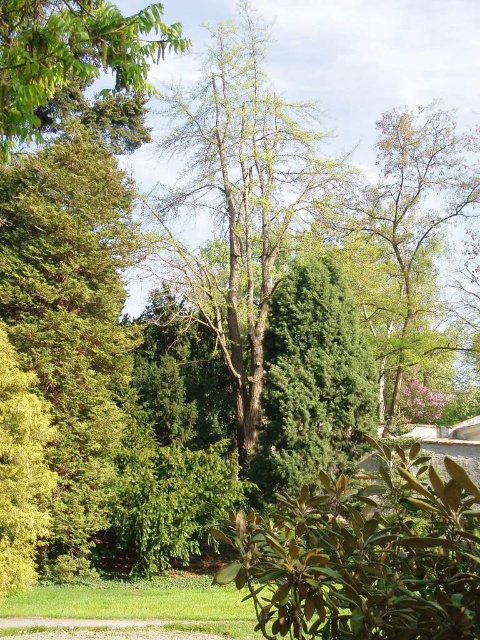
Question: Does green leathery leaves at lower center have a lesser width compared to green leafy tree at upper right?

Choices:
 (A) yes
 (B) no

Answer: (A)

Question: Which object appears farthest from the camera in this image?

Choices:
 (A) green leafy tree at center
 (B) green leathery leaves at lower center
 (C) green leafy tree at upper right

Answer: (C)

Question: Is green leafy tree at center to the right of green leafy tree at upper right from the viewer's perspective?

Choices:
 (A) yes
 (B) no

Answer: (B)

Question: Does green leafy tree at center appear on the right side of green leafy tree at upper left?

Choices:
 (A) yes
 (B) no

Answer: (A)

Question: Which point is closer to the camera taking this photo?

Choices:
 (A) (62, 26)
 (B) (432, 220)
 (C) (206, 92)
 (D) (463, 588)

Answer: (D)

Question: Estimate the real-world distances between objects in this image. Which object is closer to the green leafy tree at center?

Choices:
 (A) green leathery leaves at lower center
 (B) green leafy tree at upper left
 (C) green leafy tree at upper right

Answer: (C)